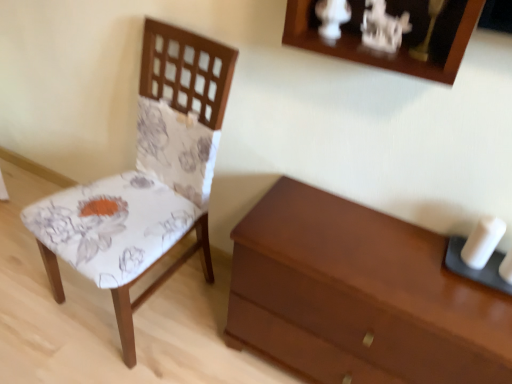
Question: Can you confirm if floral fabric chair at left is positioned to the right of matte brown chest of drawers at lower right?

Choices:
 (A) yes
 (B) no

Answer: (B)

Question: Does floral fabric chair at left come in front of matte brown chest of drawers at lower right?

Choices:
 (A) no
 (B) yes

Answer: (B)

Question: Is floral fabric chair at left far away from matte brown chest of drawers at lower right?

Choices:
 (A) no
 (B) yes

Answer: (A)

Question: Can you confirm if floral fabric chair at left is shorter than matte brown chest of drawers at lower right?

Choices:
 (A) yes
 (B) no

Answer: (B)

Question: From a real-world perspective, is floral fabric chair at left on top of matte brown chest of drawers at lower right?

Choices:
 (A) yes
 (B) no

Answer: (A)

Question: Can matte brown chest of drawers at lower right be found inside floral fabric chair at left?

Choices:
 (A) yes
 (B) no

Answer: (B)

Question: Is matte brown chest of drawers at lower right further to the viewer compared to white matte candle at right?

Choices:
 (A) no
 (B) yes

Answer: (A)

Question: Does matte brown chest of drawers at lower right have a greater width compared to white matte candle at right?

Choices:
 (A) no
 (B) yes

Answer: (B)

Question: Could you tell me if matte brown chest of drawers at lower right is turned towards white matte candle at right?

Choices:
 (A) no
 (B) yes

Answer: (A)

Question: Is matte brown chest of drawers at lower right surrounding white matte candle at right?

Choices:
 (A) yes
 (B) no

Answer: (B)

Question: Is matte brown chest of drawers at lower right smaller than white matte candle at right?

Choices:
 (A) no
 (B) yes

Answer: (A)

Question: Are matte brown chest of drawers at lower right and white matte candle at right located far from each other?

Choices:
 (A) yes
 (B) no

Answer: (B)

Question: Is matte brown chest of drawers at lower right shorter than floral fabric chair at left?

Choices:
 (A) no
 (B) yes

Answer: (B)